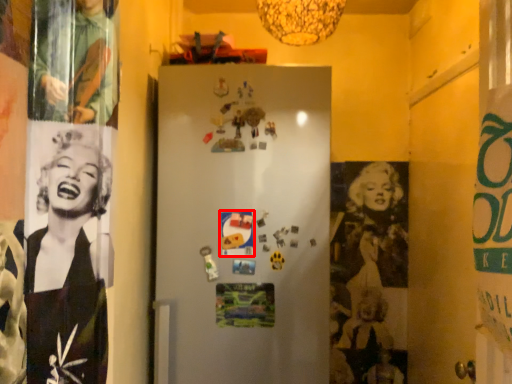
Question: Observing the image, what is the correct spatial positioning of poster page (annotated by the red box) in reference to poster page?

Choices:
 (A) right
 (B) left

Answer: (B)